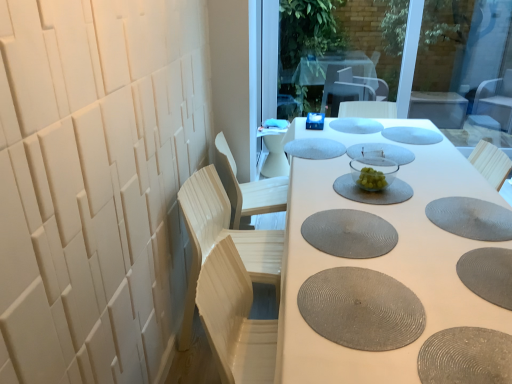
Where is `vacant space in between gray textured placemat at lower right, which is the fifth manhole cover from front to back, and gray textured placemat at center, which is counted as the fourth manhole cover, starting from the front`? The width and height of the screenshot is (512, 384). vacant space in between gray textured placemat at lower right, which is the fifth manhole cover from front to back, and gray textured placemat at center, which is counted as the fourth manhole cover, starting from the front is located at coordinates (404, 221).